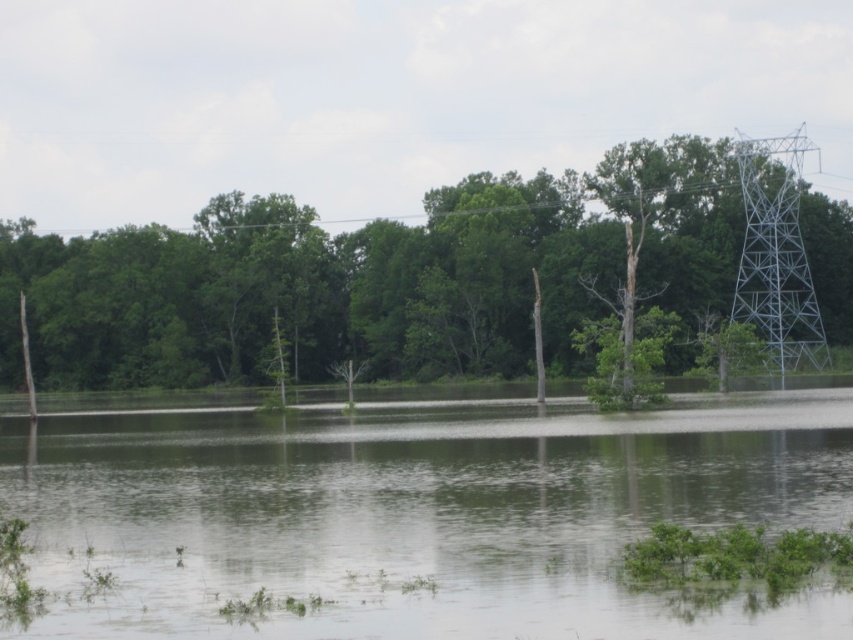
Question: Which of the following is the farthest from the observer?

Choices:
 (A) tap(665, 486)
 (B) tap(782, 269)

Answer: (B)

Question: Which of the following is the closest to the observer?

Choices:
 (A) clear water at center
 (B) green leafy tree at center

Answer: (A)

Question: Does clear water at center appear over green leafy tree at center?

Choices:
 (A) no
 (B) yes

Answer: (A)

Question: Can you confirm if clear water at center is positioned to the left of metallic gray tower at right?

Choices:
 (A) yes
 (B) no

Answer: (A)

Question: Which object is farther from the camera taking this photo?

Choices:
 (A) green leafy tree at center
 (B) clear water at center

Answer: (A)

Question: Can you confirm if green leafy tree at center is positioned above metallic gray tower at right?

Choices:
 (A) yes
 (B) no

Answer: (B)